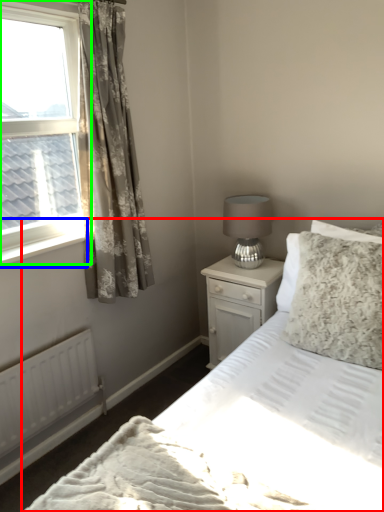
Question: Estimate the real-world distances between objects in this image. Which object is farther from bed (highlighted by a red box), window sill (highlighted by a blue box) or window (highlighted by a green box)?

Choices:
 (A) window sill
 (B) window

Answer: (B)